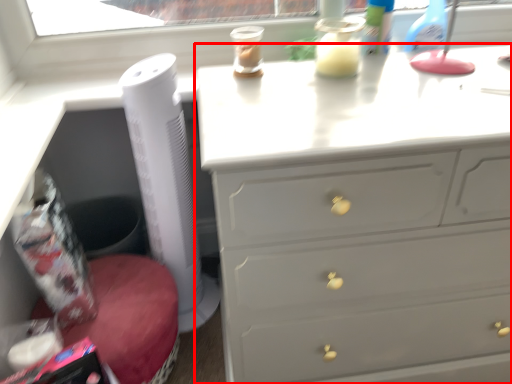
Question: From the image's perspective, where is chest of drawers (annotated by the red box) located in relation to appliance in the image?

Choices:
 (A) below
 (B) above

Answer: (A)